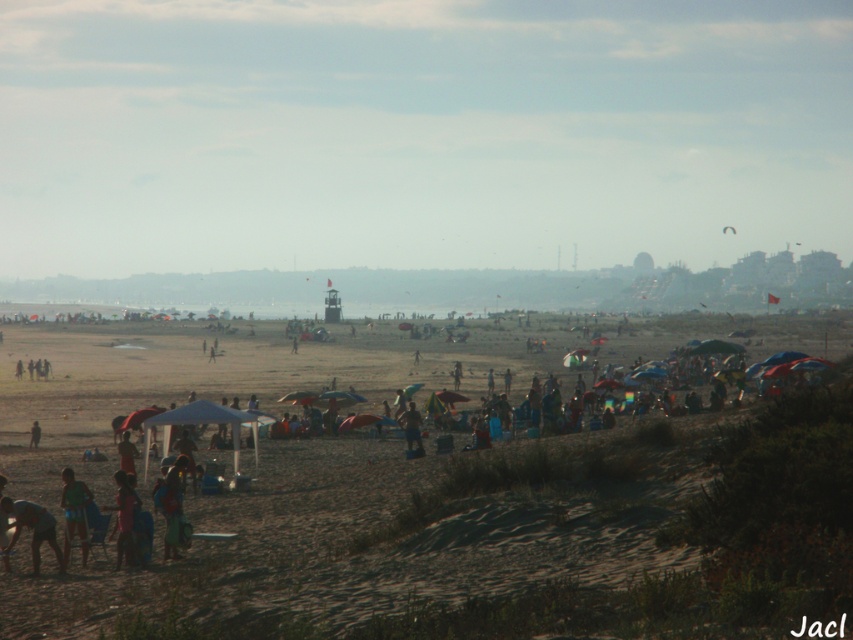
Question: Which point is closer to the camera?

Choices:
 (A) green fabric shorts at lower left
 (B) light blue fabric umbrella at lower left
 (C) pink fabric person at lower left
 (D) dark blue shorts at lower left

Answer: (D)

Question: Which of the following is the farthest from the observer?

Choices:
 (A) (45, 470)
 (B) (120, 496)
 (C) (73, 490)
 (D) (422, 451)

Answer: (A)

Question: Is brown sandy beach at center in front of pink fabric person at lower left?

Choices:
 (A) no
 (B) yes

Answer: (B)

Question: Which of these objects is positioned closest to the pink fabric person at lower left?

Choices:
 (A) tan skin person at center
 (B) dark blue shorts at lower left
 (C) brown sandy beach at center
 (D) light blue fabric umbrella at lower left

Answer: (B)

Question: From the image, what is the correct spatial relationship of green fabric shorts at lower left in relation to light blue fabric umbrella at lower left?

Choices:
 (A) below
 (B) above

Answer: (B)

Question: From the image, what is the correct spatial relationship of brown sandy beach at center in relation to tan skin person at center?

Choices:
 (A) right
 (B) left

Answer: (B)